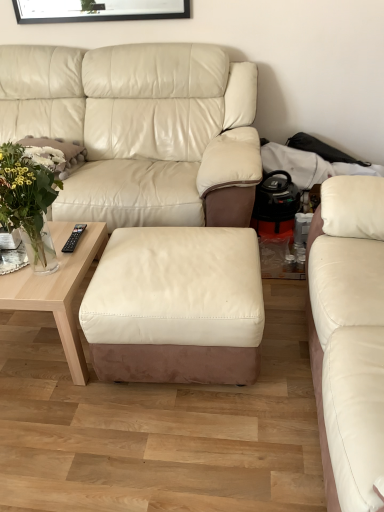
Where is `free space in front of light wood coffee table at lower left`? free space in front of light wood coffee table at lower left is located at coordinates (63, 424).